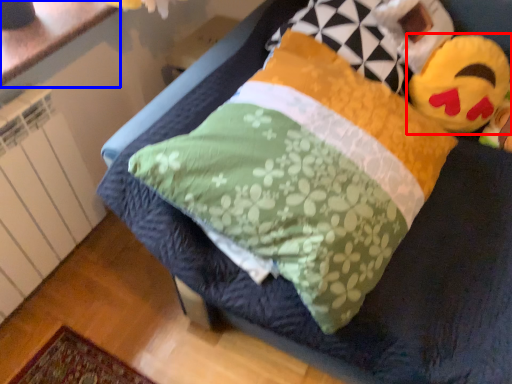
Question: Which object is closer to the camera taking this photo, toy (highlighted by a red box) or counter top (highlighted by a blue box)?

Choices:
 (A) toy
 (B) counter top

Answer: (B)